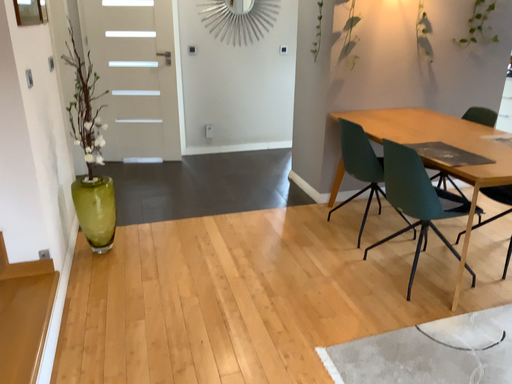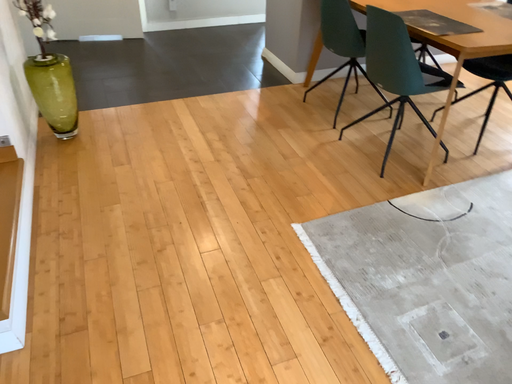
Question: How did the camera likely rotate when shooting the video?

Choices:
 (A) rotated upward
 (B) rotated downward

Answer: (B)